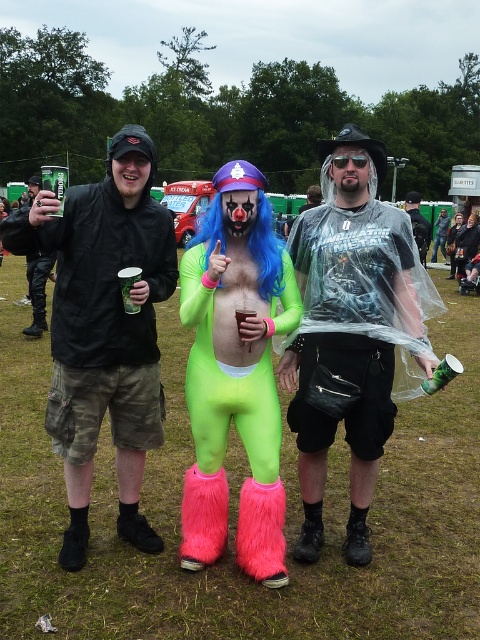
Question: Which of these objects is positioned farthest from the neon green spandex suit at center?

Choices:
 (A) clear plastic bag at center
 (B) clear plastic poncho at center
 (C) sunglasses at center

Answer: (A)

Question: Can you confirm if clear plastic poncho at center is positioned to the left of translucent plastic cup at center?

Choices:
 (A) yes
 (B) no

Answer: (B)

Question: Can you confirm if blue synthetic wig at center is positioned to the left of translucent plastic cup at center?

Choices:
 (A) no
 (B) yes

Answer: (A)

Question: Which point is closer to the camera taking this photo?

Choices:
 (A) (237, 316)
 (B) (128, 273)
 (C) (444, 237)
 (D) (277, 550)

Answer: (A)

Question: From the image, what is the correct spatial relationship of neon green spandex suit at center in relation to matte black jacket at center?

Choices:
 (A) below
 (B) above

Answer: (A)

Question: Which object appears closest to the camera in this image?

Choices:
 (A) neon green spandex suit at center
 (B) matte black jacket at center
 (C) green plastic cup at center
 (D) clear plastic poncho at center

Answer: (A)